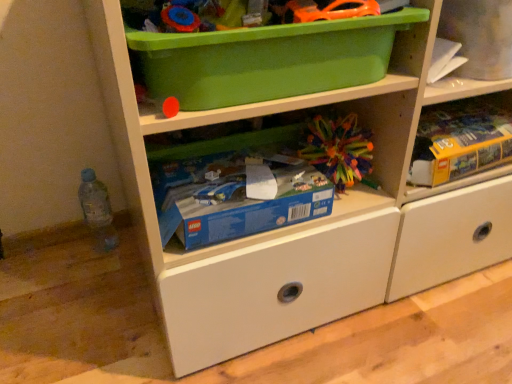
Question: Looking at the image, does orange plastic toy car at upper center, the 2th toy from the bottom, seem bigger or smaller compared to multicolored plastic ball at center, the 2th toy when ordered from front to back?

Choices:
 (A) big
 (B) small

Answer: (B)

Question: In terms of width, does orange plastic toy car at upper center, which appears as the second toy when viewed from the back, look wider or thinner when compared to multicolored plastic ball at center, which is the first toy in back-to-front order?

Choices:
 (A) thin
 (B) wide

Answer: (A)

Question: Estimate the real-world distances between objects in this image. Which object is closer to the multicolored plastic ball at center, which is the first toy in back-to-front order?

Choices:
 (A) translucent plastic bottle at lower left
 (B) orange plastic toy car at upper center, arranged as the 1th toy when viewed from the top
 (C) blue cardboard lego box at center, acting as the second storage box starting from the top
 (D) yellow cardboard box at upper right
 (E) green plastic storage box at upper center, marked as the 1th storage box in a top-to-bottom arrangement

Answer: (C)

Question: Which is nearer to the multicolored plastic ball at center, the 2th toy when ordered from front to back?

Choices:
 (A) green plastic storage box at upper center, arranged as the 2th storage box when ordered from the bottom
 (B) orange plastic toy car at upper center, which appears as the second toy when viewed from the back
 (C) blue cardboard lego box at center, the first storage box when ordered from bottom to top
 (D) translucent plastic bottle at lower left
 (E) yellow cardboard box at upper right

Answer: (C)